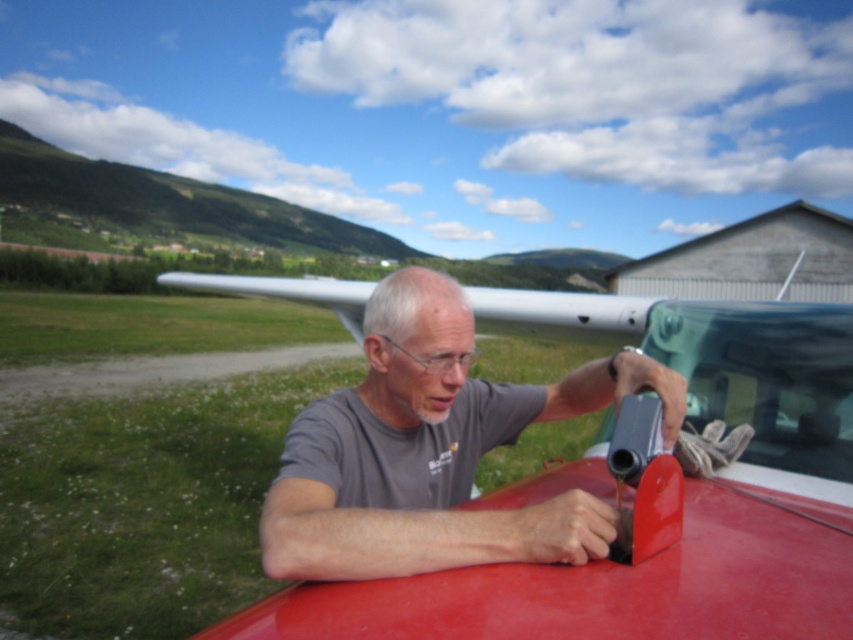
You are a safety inspector at the airfield. You notice the gray matte shirt at center and the transparent glass windshield at center. According to safety protocols, which object should be visible to ensure proper visibility for the worker?

The transparent glass windshield at center should be visible to ensure proper visibility for the worker, as the gray matte shirt at center is in front of it and might obstruct the view.

You are a safety inspector observing the man at the airfield. You notice the gray matte shirt at center and the transparent glass windshield at center. According to safety protocols, should the man be wearing his shirt under the windshield while working? Please explain your reasoning based on their positions.

The gray matte shirt at center is positioned under the transparent glass windshield at center. This placement could mean the shirt is not properly shielding the man from potential hazards like debris or spills from the liquid he is pouring. Safety protocols likely require the shirt to be worn over the windshield to protect against splashes or falling objects, so the current position may violate safety standards.

What are the coordinates of the gray matte shirt at center?

The gray matte shirt at center is located at coordinates point (x=433, y=451).